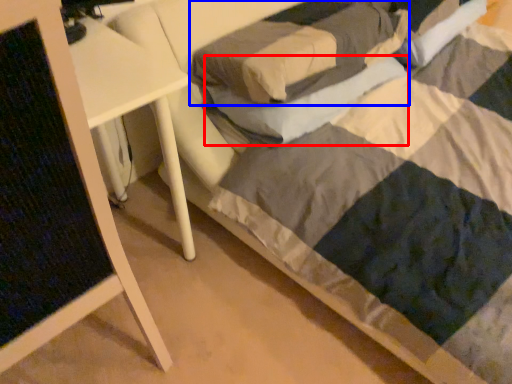
Question: Among these objects, which one is nearest to the camera, pillow (highlighted by a red box) or pillow (highlighted by a blue box)?

Choices:
 (A) pillow
 (B) pillow

Answer: (B)